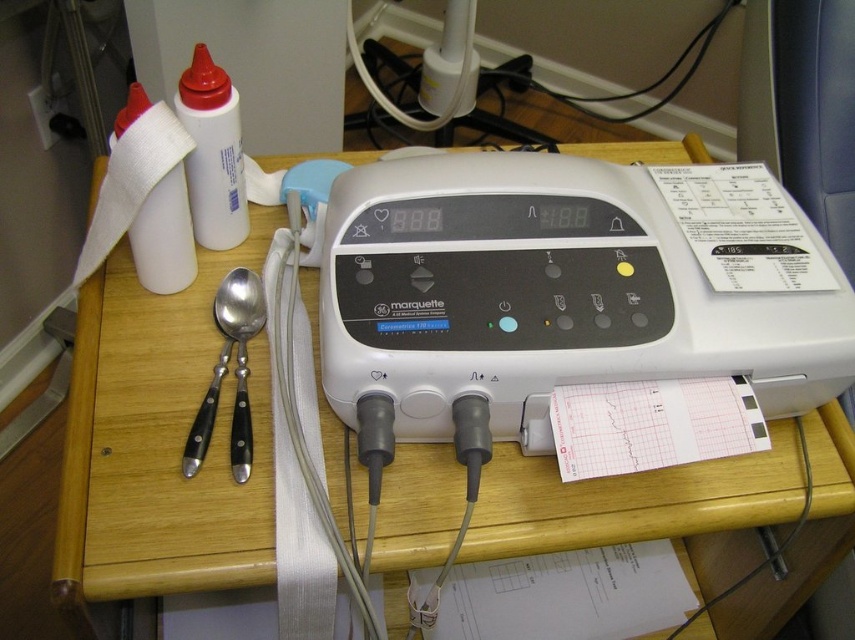
You are a nurse preparing to set up equipment for a patient. You have a white plastic bottle at upper left and a black plastic plug at upper left. Which object should you pick up first if you need to use the larger one first?

The white plastic bottle at upper left has a larger size compared to the black plastic plug at upper left, so you should pick up the white plastic bottle at upper left first.

What is located at the point with coordinates (211, 152) in the image?

The point at coordinates (211, 152) indicates a white plastic bottle at upper left.

From the picture: You are a nurse preparing to set up equipment in the clinical room. You need to place the white plastic bottle at upper left and the black plastic plug at upper left on a narrow shelf that can only fit one item. Which item should you choose to place on the shelf?

The black plastic plug at upper left should be placed on the shelf because the white plastic bottle at upper left is wider and cannot fit on the narrow shelf.